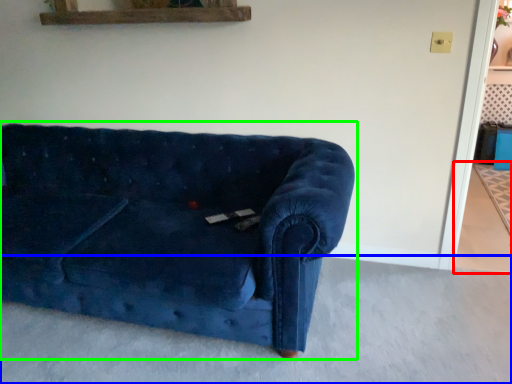
Question: Which object is positioned farthest from concrete (highlighted by a red box)? Select from concrete (highlighted by a blue box) and studio couch (highlighted by a green box).

Choices:
 (A) concrete
 (B) studio couch

Answer: (B)